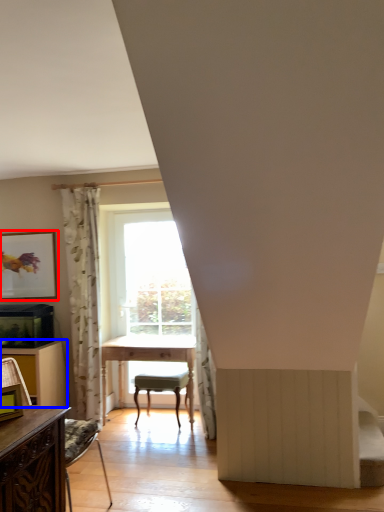
Question: Among these objects, which one is nearest to the camera, picture frame (highlighted by a red box) or dresser (highlighted by a blue box)?

Choices:
 (A) picture frame
 (B) dresser

Answer: (B)